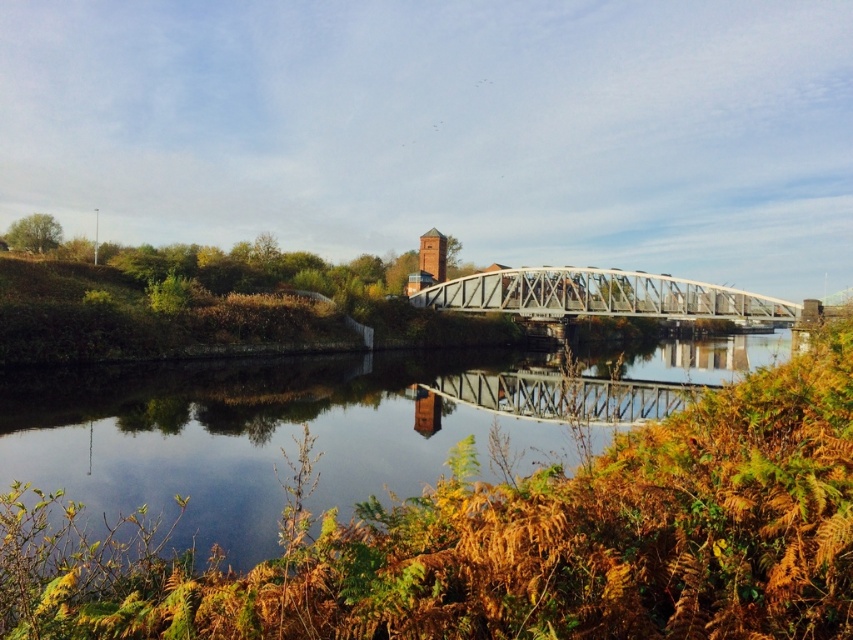
Between smooth reflective water at center and metallic gray bridge at center, which one appears on the left side from the viewer's perspective?

From the viewer's perspective, metallic gray bridge at center appears more on the left side.

From the picture: Can you confirm if smooth reflective water at center is thinner than metallic gray bridge at center?

No, smooth reflective water at center is not thinner than metallic gray bridge at center.

Image resolution: width=853 pixels, height=640 pixels. What do you see at coordinates (236, 436) in the screenshot? I see `smooth reflective water at center` at bounding box center [236, 436].

Where is `smooth reflective water at center`? The width and height of the screenshot is (853, 640). smooth reflective water at center is located at coordinates 236,436.